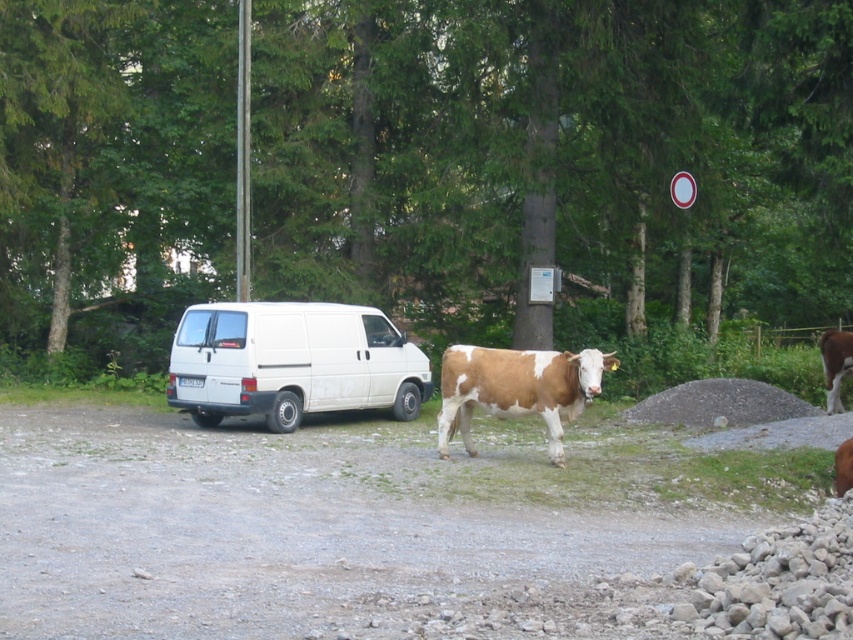
You are a farmer checking your herd. You see the brown and white textured cow at center and the brown speckled hide at right. Which cow is closer to the right edge of the image?

The brown speckled hide at right is closer to the right edge of the image because the brown and white textured cow at center is positioned on its left side.